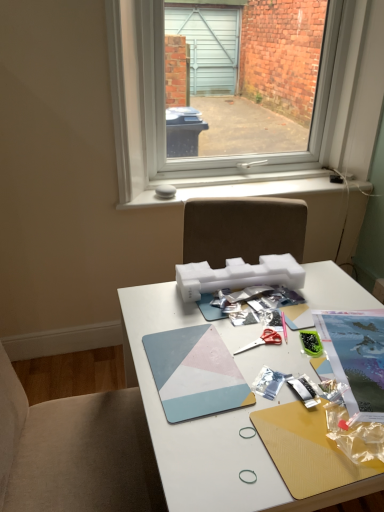
Identify the location of free spot to the right of geometric matte mousepad at center, acting as the 2th magazine starting from the right. This screenshot has width=384, height=512. (274, 358).